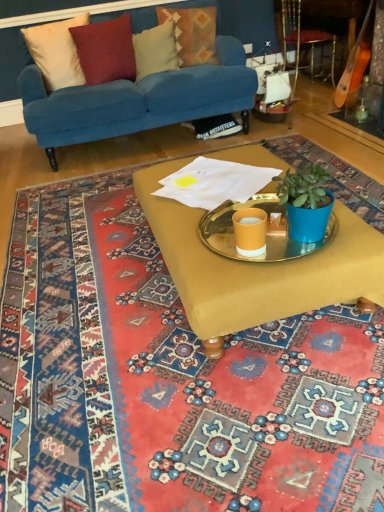
Question: Is textured woolen pillow at upper center, the first pillow viewed from the right, thinner than velvet cushion at upper left, which is the fourth pillow from right to left?

Choices:
 (A) yes
 (B) no

Answer: (B)

Question: Does textured woolen pillow at upper center, the fourth pillow when ordered from left to right, have a smaller size compared to velvet cushion at upper left, which is the first pillow from left to right?

Choices:
 (A) yes
 (B) no

Answer: (B)

Question: From the image's perspective, does textured woolen pillow at upper center, the fourth pillow when ordered from left to right, appear lower than velvet cushion at upper left, which is the first pillow from left to right?

Choices:
 (A) no
 (B) yes

Answer: (A)

Question: Is textured woolen pillow at upper center, the first pillow viewed from the right, aimed at velvet cushion at upper left, which is the fourth pillow from right to left?

Choices:
 (A) yes
 (B) no

Answer: (B)

Question: Considering the relative sizes of textured woolen pillow at upper center, the first pillow viewed from the right, and velvet cushion at upper left, which is the fourth pillow from right to left, in the image provided, is textured woolen pillow at upper center, the first pillow viewed from the right, shorter than velvet cushion at upper left, which is the fourth pillow from right to left,?

Choices:
 (A) no
 (B) yes

Answer: (B)

Question: Does textured woolen pillow at upper center, the first pillow viewed from the right, lie in front of velvet cushion at upper left, which is the fourth pillow from right to left?

Choices:
 (A) no
 (B) yes

Answer: (A)

Question: From the image's perspective, is metallic tray at center above textured woolen pillow at upper center, the fourth pillow when ordered from left to right?

Choices:
 (A) no
 (B) yes

Answer: (A)

Question: Is metallic tray at center positioned with its back to textured woolen pillow at upper center, the fourth pillow when ordered from left to right?

Choices:
 (A) yes
 (B) no

Answer: (B)

Question: Would you say metallic tray at center is outside textured woolen pillow at upper center, the fourth pillow when ordered from left to right?

Choices:
 (A) yes
 (B) no

Answer: (A)

Question: Is metallic tray at center shorter than textured woolen pillow at upper center, the fourth pillow when ordered from left to right?

Choices:
 (A) no
 (B) yes

Answer: (B)

Question: Is metallic tray at center beside textured woolen pillow at upper center, the fourth pillow when ordered from left to right?

Choices:
 (A) yes
 (B) no

Answer: (B)

Question: Is metallic tray at center positioned in front of textured woolen pillow at upper center, the fourth pillow when ordered from left to right?

Choices:
 (A) no
 (B) yes

Answer: (B)

Question: Is velvet cushion at upper center, the 3th pillow from the left, positioned far away from metallic tray at center?

Choices:
 (A) no
 (B) yes

Answer: (B)